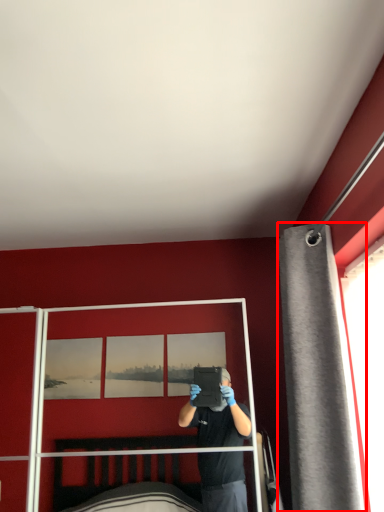
Question: From the image's perspective, considering the relative positions of curtain (annotated by the red box) and screen door in the image provided, where is curtain (annotated by the red box) located with respect to the staircase?

Choices:
 (A) above
 (B) below

Answer: (A)